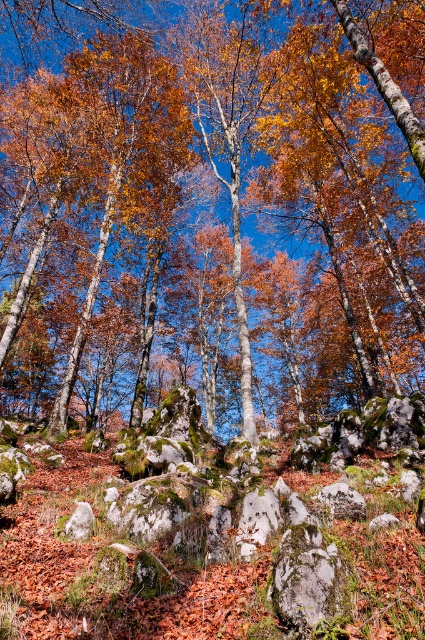
Question: Can you confirm if smooth stone boulder at center is thinner than mossy stone hillside at center?

Choices:
 (A) no
 (B) yes

Answer: (A)

Question: From the image, what is the correct spatial relationship of smooth stone boulder at center in relation to mossy stone hillside at center?

Choices:
 (A) below
 (B) above

Answer: (B)

Question: Among these objects, which one is nearest to the camera?

Choices:
 (A) mossy stone hillside at center
 (B) smooth stone boulder at center

Answer: (A)

Question: Can you confirm if smooth stone boulder at center is positioned to the right of mossy stone hillside at center?

Choices:
 (A) no
 (B) yes

Answer: (B)

Question: Which of the following is the closest to the observer?

Choices:
 (A) (419, 333)
 (B) (84, 509)

Answer: (B)